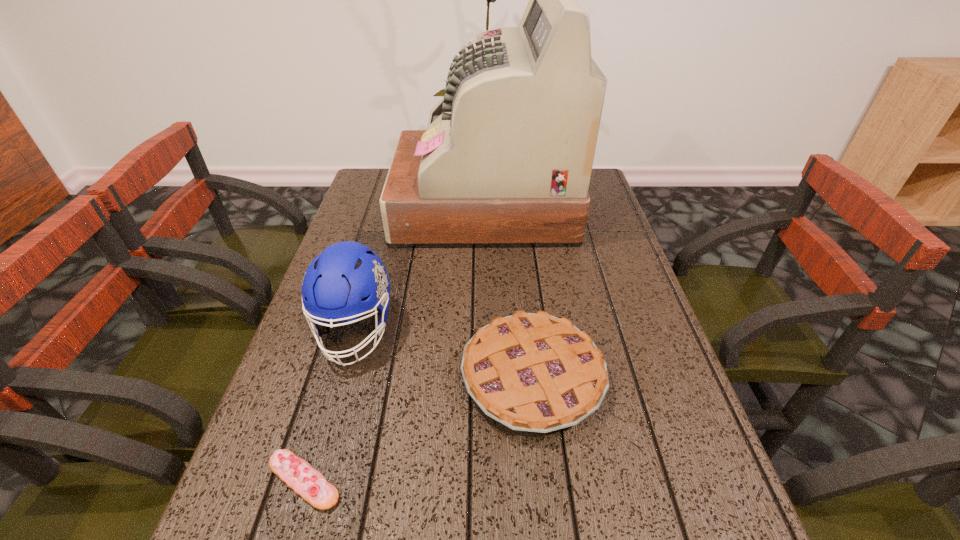
Image resolution: width=960 pixels, height=540 pixels. I want to click on object that is positioned at the far edge, so click(506, 160).

Identify the location of cash register present at the left edge. (506, 160).

You are a GUI agent. You are given a task and a screenshot of the screen. Output one action in this format:
    pyautogui.click(x=<x>, y=<y>)
    Task: Click on the football helmet that is at the left edge
    The height and width of the screenshot is (540, 960).
    Given the screenshot: What is the action you would take?
    pyautogui.click(x=334, y=283)

Locate an element on the screen. The image size is (960, 540). eclair that is at the left edge is located at coordinates (298, 474).

You are a GUI agent. You are given a task and a screenshot of the screen. Output one action in this format:
    pyautogui.click(x=<x>, y=<y>)
    Task: Click on the cash register present at the right edge
    The image size is (960, 540).
    Given the screenshot: What is the action you would take?
    pyautogui.click(x=506, y=160)

The image size is (960, 540). Find the location of `pie that is at the right edge`. pie that is at the right edge is located at coordinates (537, 373).

Locate an element on the screen. This screenshot has height=540, width=960. object at the far left corner is located at coordinates (506, 160).

The width and height of the screenshot is (960, 540). Identify the location of object that is at the far right corner. (506, 160).

At what (x,y) coordinates should I click in order to perform the action: click on free space at the left edge of the desktop. Please return your answer as a coordinate pair (x, y). Looking at the image, I should click on (364, 241).

Image resolution: width=960 pixels, height=540 pixels. In the image, there is a desktop. Find the location of `vacant space at the right edge`. vacant space at the right edge is located at coordinates (608, 335).